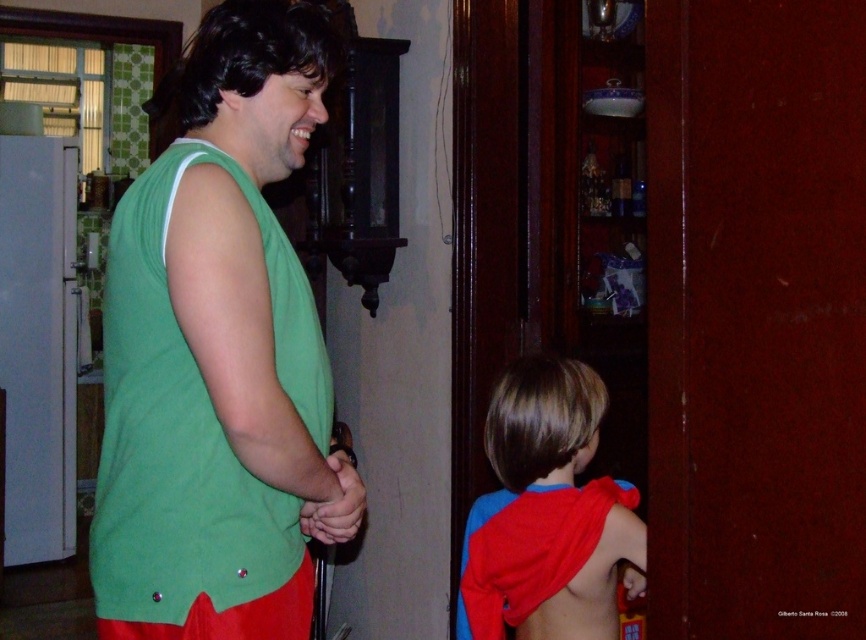
Is green fabric shirt at center above red fabric cape at lower right?

Yes.

Which of these two, green fabric shirt at center or red fabric cape at lower right, stands shorter?

red fabric cape at lower right

Which is behind, point (115, 369) or point (522, 540)?

Positioned behind is point (522, 540).

Identify the location of green fabric shirt at center. This screenshot has width=866, height=640. (218, 353).